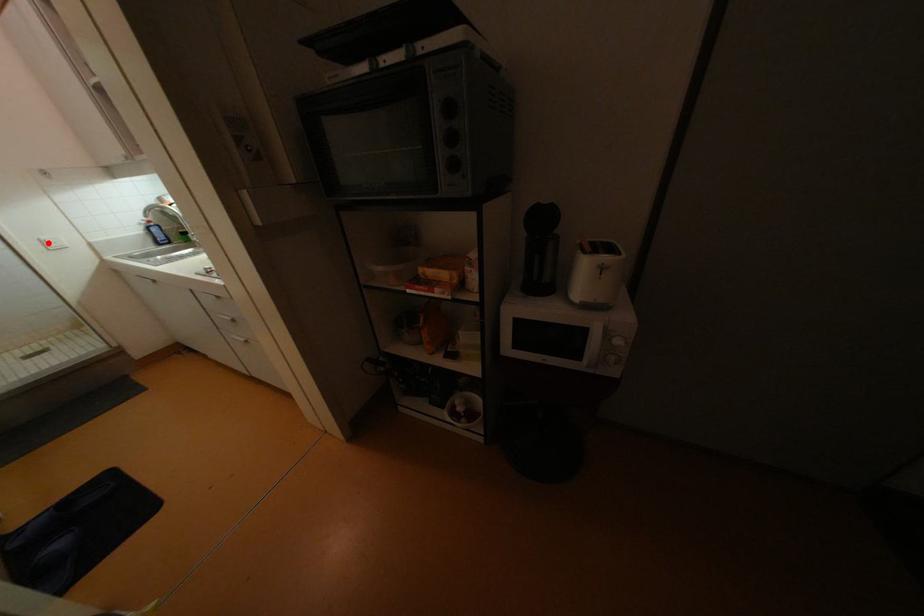
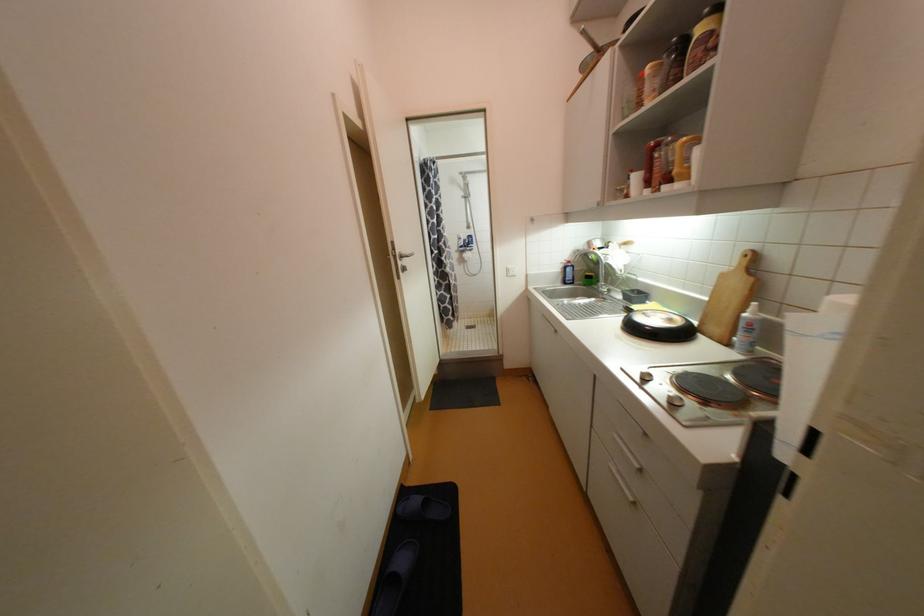
In the second image, find the point that corresponds to the highlighted location in the first image.

(513, 270)